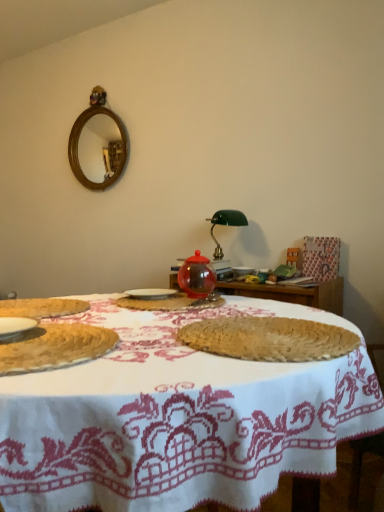
Question: Visually, is bread at left, the third food from the back, positioned to the left or to the right of transparent glass jar at center, which appears as the first food when viewed from the back?

Choices:
 (A) right
 (B) left

Answer: (B)

Question: In terms of height, does bread at left, which is the 1th food in front-to-back order, look taller or shorter compared to transparent glass jar at center, which is the 3th food in front-to-back order?

Choices:
 (A) short
 (B) tall

Answer: (B)

Question: Estimate the real-world distances between objects in this image. Which object is farther from the transparent glass jar at center, which is the 3th food in front-to-back order?

Choices:
 (A) bread at left, the third food from the back
 (B) green glass table lamp at center
 (C) white ceramic plate at center
 (D) white woven placemat at center
 (E) braided straw placemat at center, arranged as the second food when viewed from the front

Answer: (B)

Question: Based on their relative distances, which object is farther from the transparent glass jar at center, which is the 3th food in front-to-back order?

Choices:
 (A) white woven placemat at center
 (B) green glass table lamp at center
 (C) transparent glass teapot at center
 (D) bread at left, which is the 1th food in front-to-back order
 (E) braided straw placemat at center, the second food positioned from the back

Answer: (B)